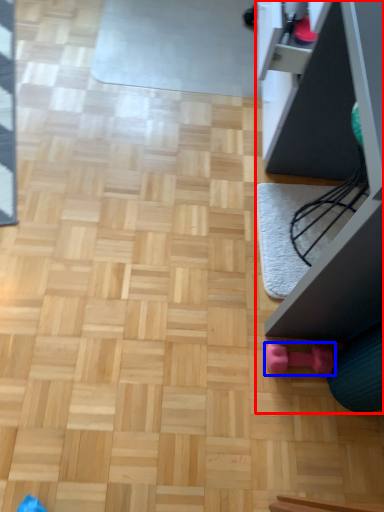
Question: Which point is closer to the camera, furniture (highlighted by a red box) or toy (highlighted by a blue box)?

Choices:
 (A) furniture
 (B) toy

Answer: (A)